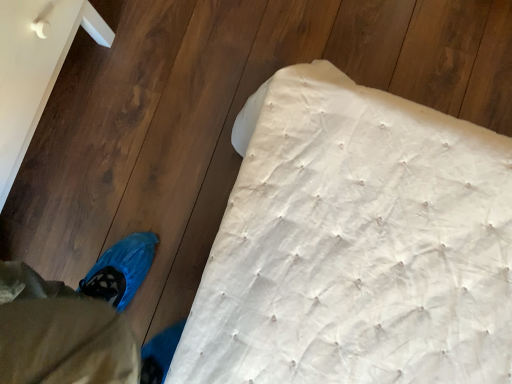
Question: From the image's perspective, is blue fabric bag at lower left located above or below white quilted mattress at lower right?

Choices:
 (A) below
 (B) above

Answer: (B)

Question: Is blue fabric bag at lower left spatially inside white quilted mattress at lower right, or outside of it?

Choices:
 (A) inside
 (B) outside

Answer: (B)

Question: Is blue fabric bag at lower left bigger or smaller than white quilted mattress at lower right?

Choices:
 (A) big
 (B) small

Answer: (B)

Question: Is white quilted mattress at lower right taller or shorter than blue fabric bag at lower left?

Choices:
 (A) short
 (B) tall

Answer: (A)

Question: From a real-world perspective, is white quilted mattress at lower right physically located above or below blue fabric bag at lower left?

Choices:
 (A) above
 (B) below

Answer: (B)

Question: From the image's perspective, is white quilted mattress at lower right positioned above or below blue fabric bag at lower left?

Choices:
 (A) below
 (B) above

Answer: (A)

Question: Looking at their shapes, would you say white quilted mattress at lower right is wider or thinner than blue fabric bag at lower left?

Choices:
 (A) thin
 (B) wide

Answer: (B)